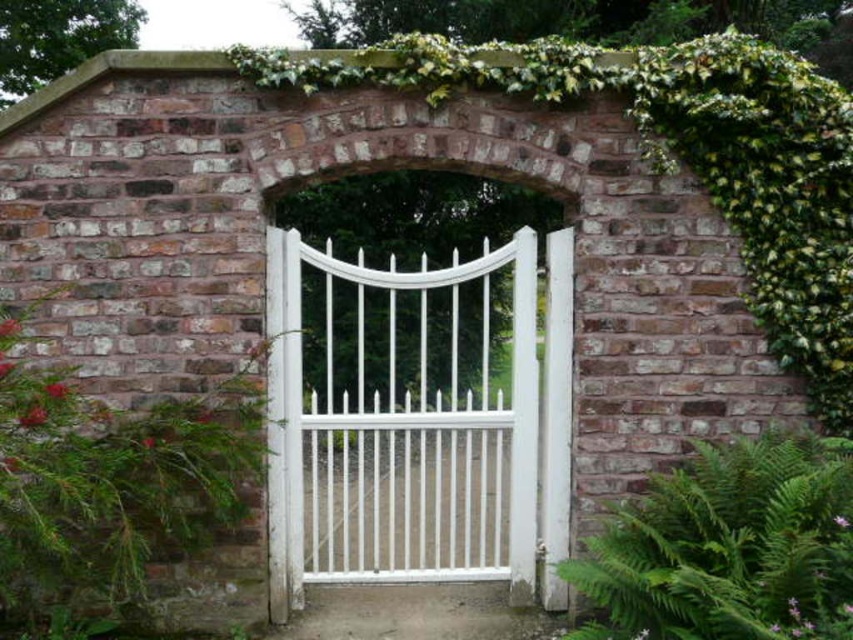
Question: Which point is closer to the camera?

Choices:
 (A) green leafy fern at lower right
 (B) white painted metal gate at center

Answer: (A)

Question: Does white painted metal gate at center appear over green leafy fern at lower right?

Choices:
 (A) yes
 (B) no

Answer: (B)

Question: Does white painted metal gate at center come in front of green leafy fern at lower right?

Choices:
 (A) yes
 (B) no

Answer: (B)

Question: Does white painted metal gate at center lie behind green leafy fern at lower right?

Choices:
 (A) yes
 (B) no

Answer: (A)

Question: Which of the following is the closest to the observer?

Choices:
 (A) green leafy fern at lower right
 (B) white painted metal gate at center

Answer: (A)